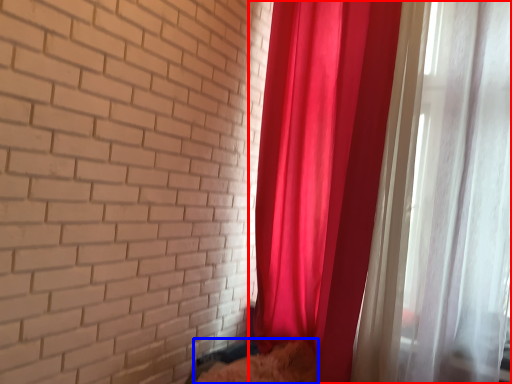
Question: Among these objects, which one is farthest to the camera, curtain (highlighted by a red box) or animal (highlighted by a blue box)?

Choices:
 (A) curtain
 (B) animal

Answer: (B)